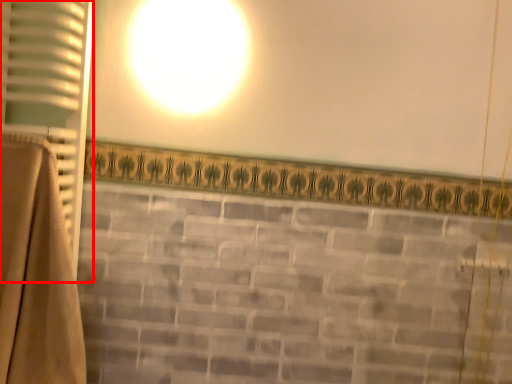
Question: From the image's perspective, what is the correct spatial positioning of curtain (annotated by the red box) in reference to curtain?

Choices:
 (A) below
 (B) above

Answer: (B)